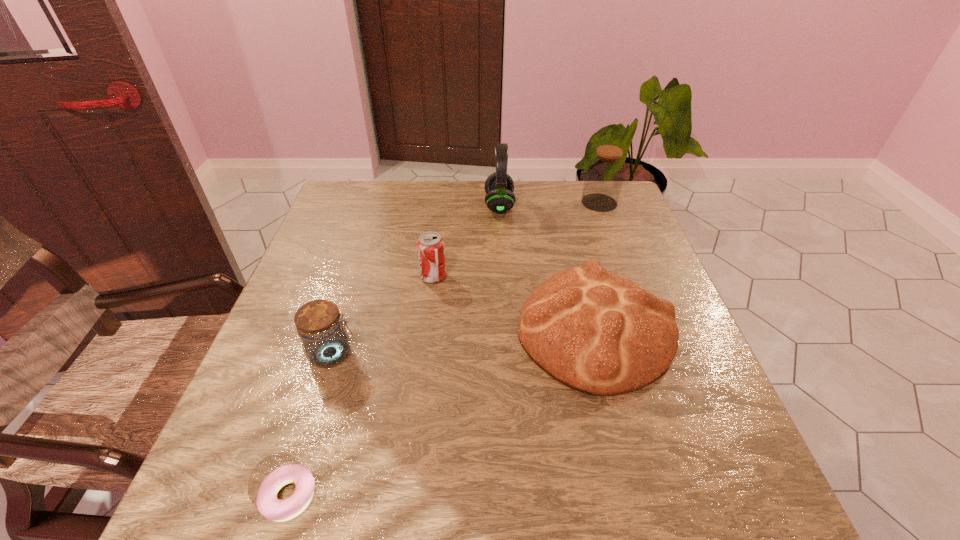
What are the coordinates of `headset` in the screenshot? It's located at tap(499, 186).

Find the location of a particular element. the taller jar is located at coordinates (605, 172).

Identify the location of the right jar. The width and height of the screenshot is (960, 540). (605, 172).

You are a GUI agent. You are given a task and a screenshot of the screen. Output one action in this format:
    pyautogui.click(x=<x>, y=<y>)
    Task: Click on the soda can
    
    Given the screenshot: What is the action you would take?
    click(x=430, y=246)

You are a GUI agent. You are given a task and a screenshot of the screen. Output one action in this format:
    pyautogui.click(x=<x>, y=<y>)
    Task: Click on the bread
    The height and width of the screenshot is (540, 960).
    Given the screenshot: What is the action you would take?
    pyautogui.click(x=599, y=333)

Identify the location of the shorter jar. The width and height of the screenshot is (960, 540). (325, 342).

Find the location of `the nearer jar`. the nearer jar is located at coordinates (325, 342).

Image resolution: width=960 pixels, height=540 pixels. I want to click on doughnut, so click(269, 506).

Image resolution: width=960 pixels, height=540 pixels. In order to click on the shortest object in this screenshot , I will do `click(269, 506)`.

At what (x,y) coordinates should I click in order to perform the action: click on vacant space located on the ear cups of the headset. Please return your answer as a coordinate pair (x, y). Looking at the image, I should click on (370, 205).